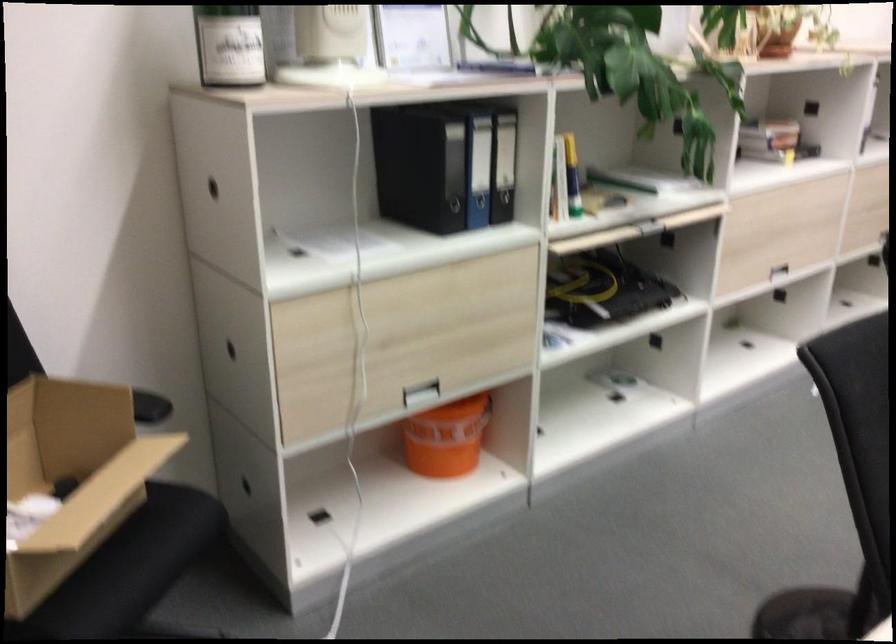
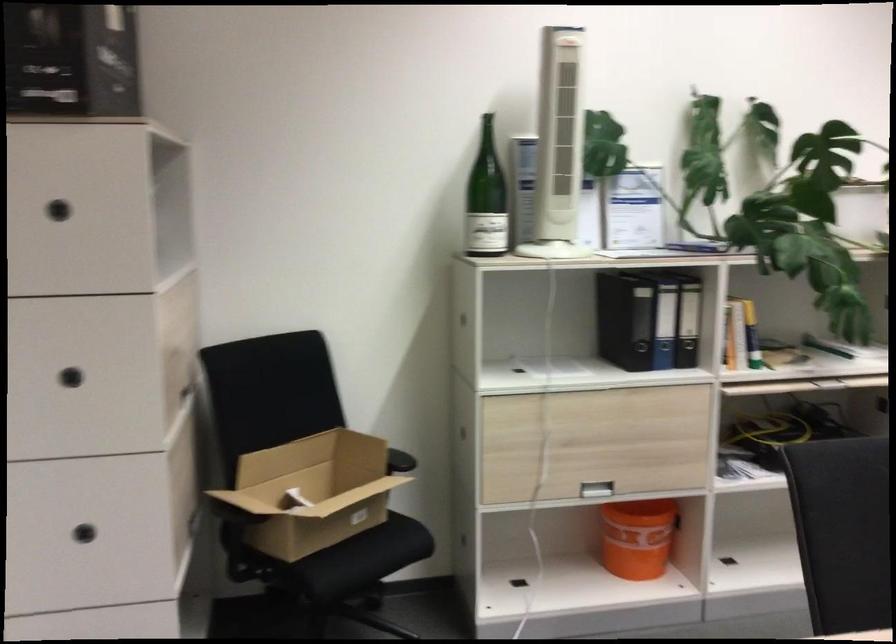
In the second image, find the point that corresponds to (504,166) in the first image.

(688, 321)